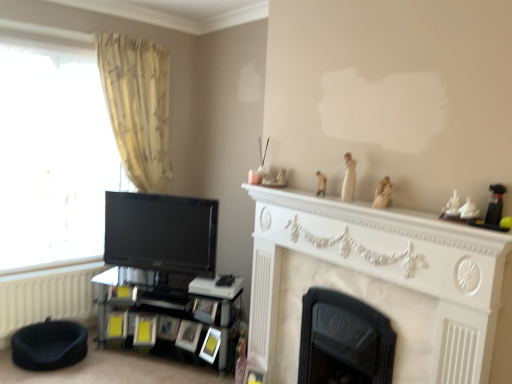
Question: From a real-world perspective, relative to black glossy shelf at lower left, is black glossy tv at left vertically above or below?

Choices:
 (A) below
 (B) above

Answer: (B)

Question: Is black glossy tv at left spatially inside black glossy shelf at lower left, or outside of it?

Choices:
 (A) outside
 (B) inside

Answer: (A)

Question: Which object is the closest to the white textured radiator at lower left?

Choices:
 (A) rubberized black toy at upper right, which is the third toy in back-to-front order
 (B) white porcelain figurine at upper right
 (C) matte white picture frame at lower center, which is counted as the 1th picture frame, starting from the left
 (D) matte yellow picture frame at lower center, marked as the 2th picture frame in a left-to-right arrangement
 (E) white marble fireplace at upper center

Answer: (C)

Question: Based on their relative distances, which object is farther from the black glossy shelf at lower left?

Choices:
 (A) transparent glass window at left
 (B) matte yellow picture frame at lower center, which is the 1th picture frame in front-to-back order
 (C) black cast iron fireplace at center, placed as the 2th fireplace when sorted from front to back
 (D) white marble fireplace at upper center
 (E) beige textured curtain at left

Answer: (D)